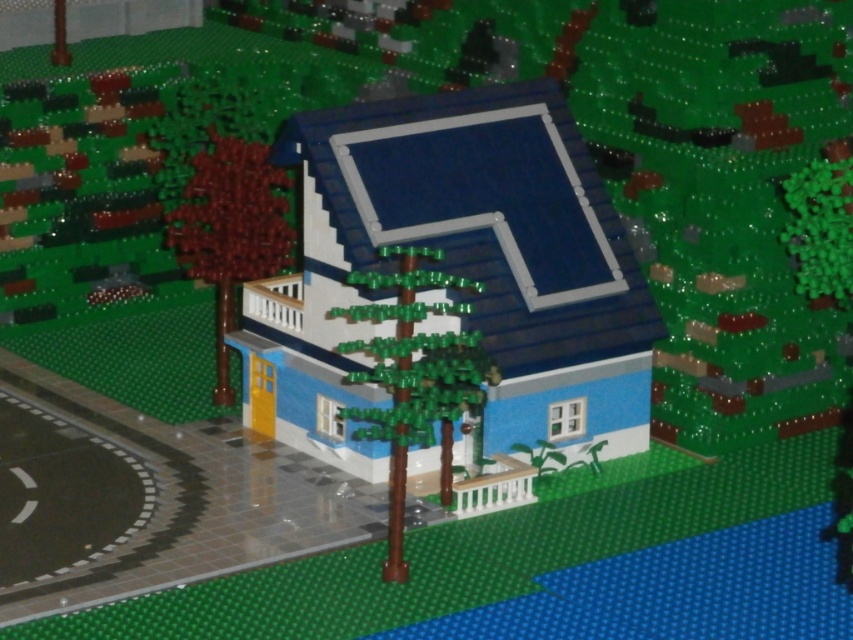
Is brown matte tree at left taller than green matte tree at right?

Incorrect, brown matte tree at left's height is not larger of green matte tree at right's.

Image resolution: width=853 pixels, height=640 pixels. I want to click on brown matte tree at left, so click(231, 228).

Which of these two, green matte tree at center or brown matte tree at left, stands shorter?

With less height is brown matte tree at left.

Is point (439, 394) closer to camera compared to point (225, 372)?

Yes, point (439, 394) is in front of point (225, 372).

The image size is (853, 640). I want to click on green matte tree at center, so click(415, 376).

Is green matte tree at center bigger than green matte tree at right?

Yes.

Does green matte tree at center appear under green matte tree at right?

Actually, green matte tree at center is above green matte tree at right.

Locate an element on the screen. The width and height of the screenshot is (853, 640). green matte tree at center is located at coordinates (415, 376).